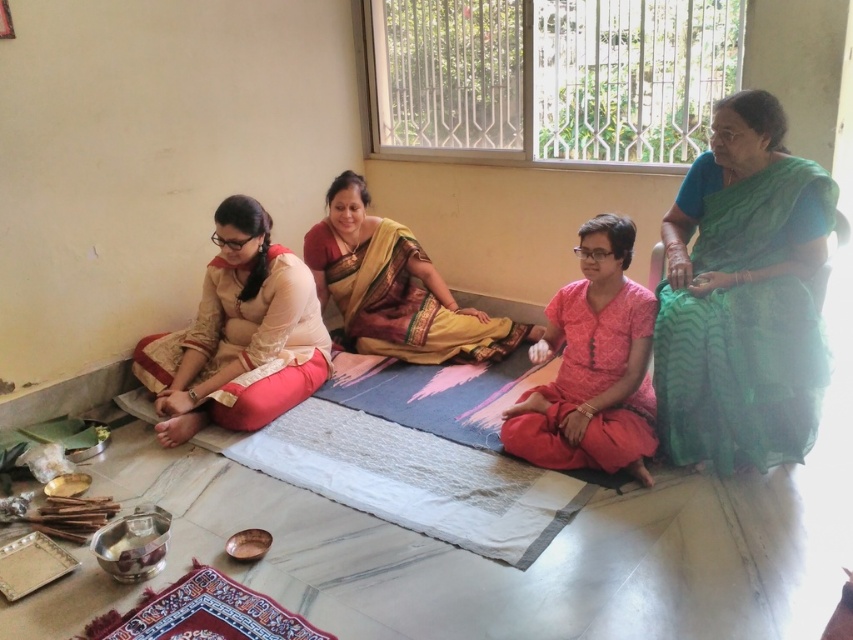
Question: Is matte beige saree at left thinner than pink cotton kurta at center?

Choices:
 (A) no
 (B) yes

Answer: (A)

Question: Considering the real-world distances, which object is closest to the green sheer saree at right?

Choices:
 (A) pink cotton kurta at center
 (B) matte beige saree at left
 (C) brown silk saree at center

Answer: (A)

Question: Which object is closer to the camera taking this photo?

Choices:
 (A) pink cotton kurta at center
 (B) brown silk saree at center

Answer: (A)

Question: Considering the real-world distances, which object is farthest from the pink cotton kurta at center?

Choices:
 (A) green sheer saree at right
 (B) matte beige saree at left
 (C) brown silk saree at center
 (D) embroidered silk mat at lower left

Answer: (D)

Question: Can you confirm if matte beige saree at left is wider than embroidered silk mat at lower left?

Choices:
 (A) no
 (B) yes

Answer: (B)

Question: Can you confirm if matte beige saree at left is positioned below brown silk saree at center?

Choices:
 (A) no
 (B) yes

Answer: (B)